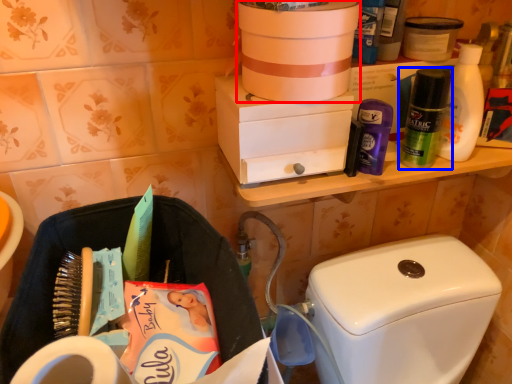
Question: Which of the following is the farthest to the observer, box (highlighted by a red box) or toiletry (highlighted by a blue box)?

Choices:
 (A) box
 (B) toiletry

Answer: (B)